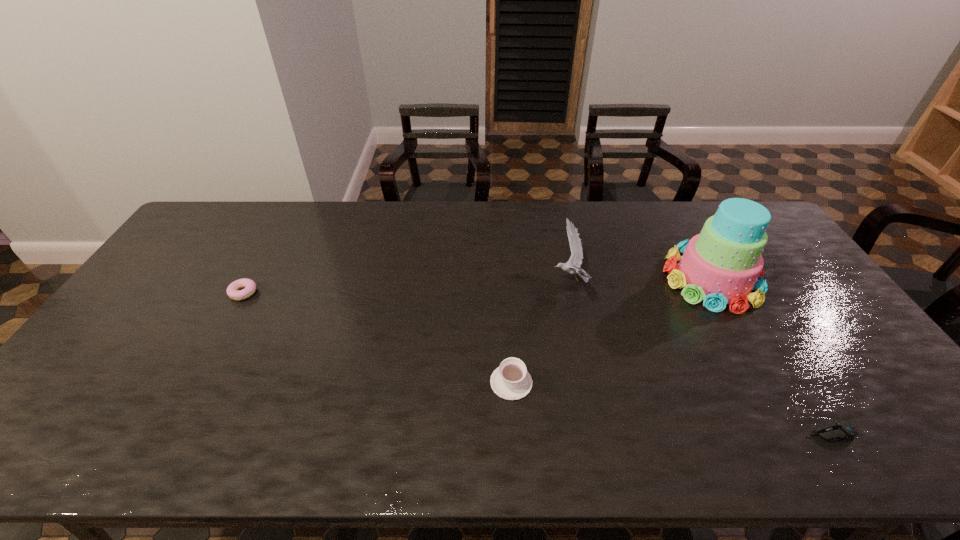
Identify the location of cake. (721, 265).

Locate an element on the screen. The image size is (960, 540). the fourth shortest object is located at coordinates (576, 247).

Identify the location of the third object from left to right. (576, 247).

In order to click on the second object from left to right in this screenshot , I will do `click(511, 381)`.

The width and height of the screenshot is (960, 540). Identify the location of the third tallest object. (511, 381).

Identify the location of doughnut. The width and height of the screenshot is (960, 540). (233, 291).

What are the coordinates of `computer mouse` in the screenshot? It's located at (836, 430).

The width and height of the screenshot is (960, 540). I want to click on free space located 0.120m on the front of the cake, so click(x=751, y=348).

The width and height of the screenshot is (960, 540). In order to click on vacant space situated 0.120m at the tip of the beak of the gull in this screenshot , I will do `click(514, 280)`.

Locate an element on the screen. The height and width of the screenshot is (540, 960). free space located at the tip of the beak of the gull is located at coordinates (498, 280).